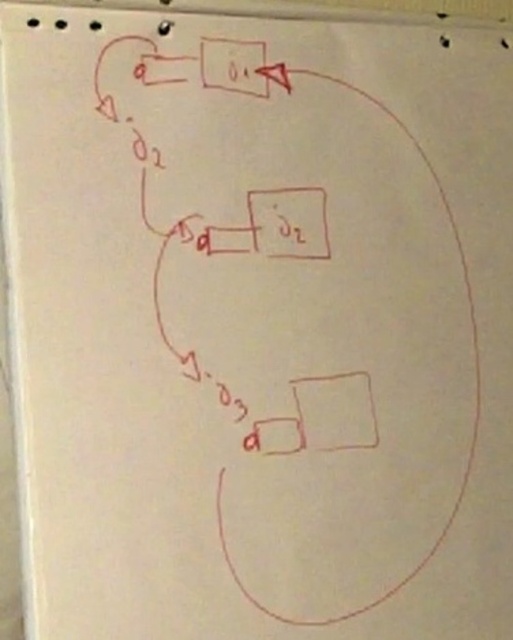
Who is more forward, (x=299, y=385) or (x=264, y=218)?

Point (x=299, y=385) is more forward.

Who is more distant from viewer, (x=321, y=433) or (x=298, y=237)?

Positioned behind is point (x=298, y=237).

This screenshot has width=513, height=640. What do you see at coordinates (336, 412) in the screenshot?
I see `white paper notepad at lower right` at bounding box center [336, 412].

At what (x,y) coordinates should I click in order to perform the action: click on white paper notepad at lower right. Please return your answer as a coordinate pair (x, y). This screenshot has width=513, height=640. Looking at the image, I should click on pyautogui.click(x=336, y=412).